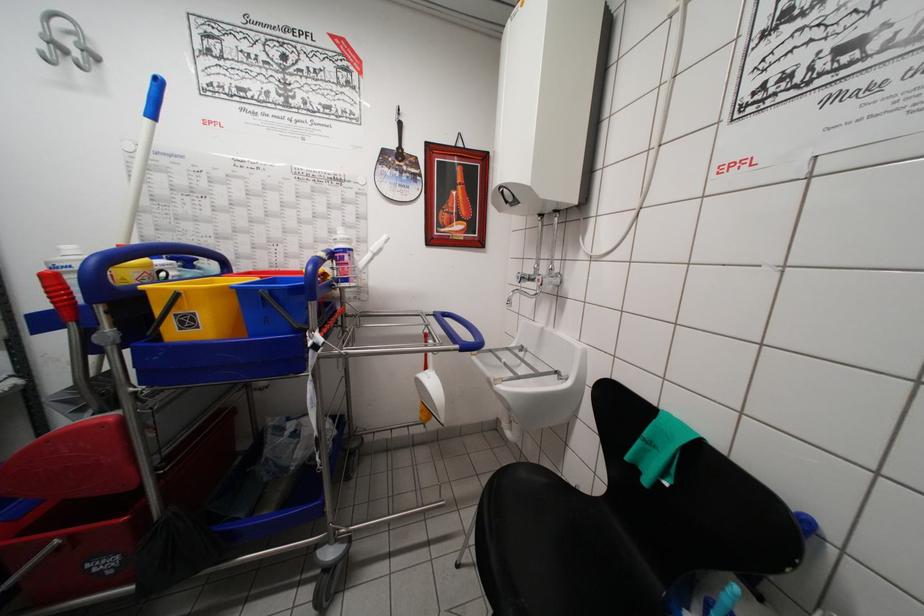
Find the location of `blue mop handle`. blue mop handle is located at coordinates (142, 153).